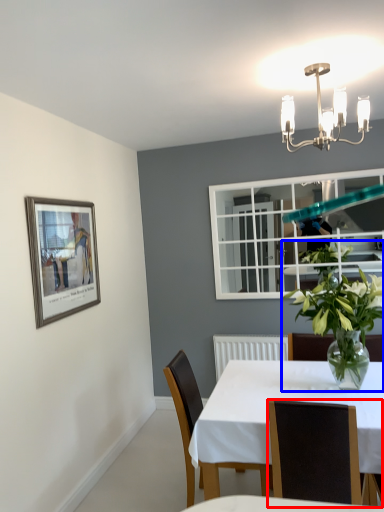
Question: Which object appears closest to the camera in this image, chair (highlighted by a red box) or houseplant (highlighted by a blue box)?

Choices:
 (A) chair
 (B) houseplant

Answer: (A)